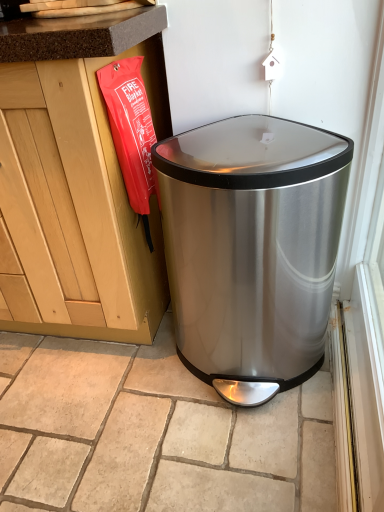
The image size is (384, 512). I want to click on free point to the left of stainless steel trash can at lower right, so pos(120,390).